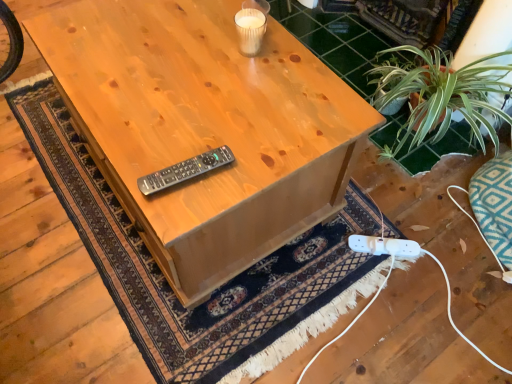
Question: Looking at the image, does black plastic remote at center seem bigger or smaller compared to white plastic plug at lower right?

Choices:
 (A) small
 (B) big

Answer: (A)

Question: Visually, is black plastic remote at center positioned to the left or to the right of white plastic plug at lower right?

Choices:
 (A) left
 (B) right

Answer: (A)

Question: Which of these objects is positioned farthest from the natural wood table at center?

Choices:
 (A) white plastic plug at lower right
 (B) black plastic remote at center

Answer: (A)

Question: Estimate the real-world distances between objects in this image. Which object is farther from the black plastic remote at center?

Choices:
 (A) white plastic plug at lower right
 (B) natural wood table at center

Answer: (A)